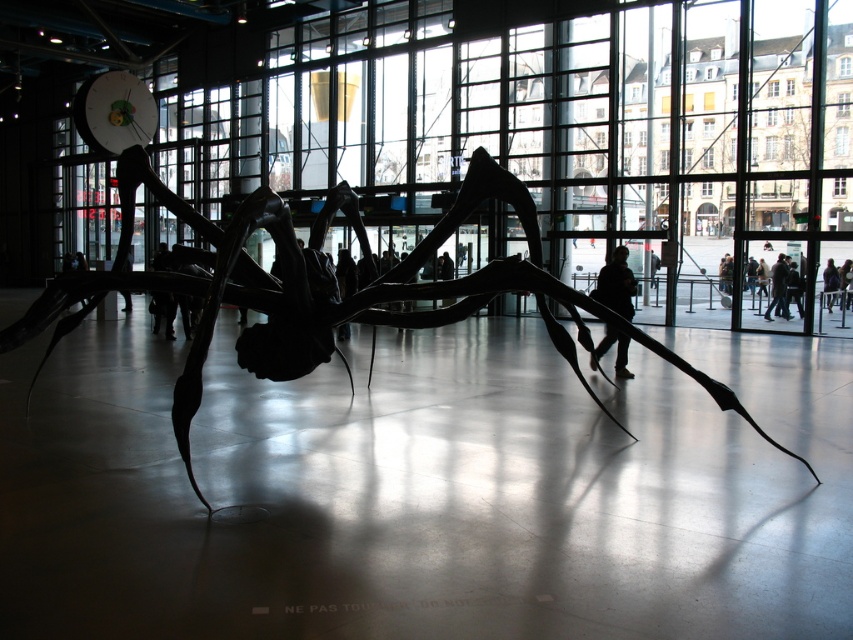
Question: Among these objects, which one is nearest to the camera?

Choices:
 (A) black matte jacket at center
 (B) black matte spider at center
 (C) dark hair at center
 (D) dark blue jeans at lower right

Answer: (B)

Question: Considering the real-world distances, which object is farthest from the dark blue jeans at lower right?

Choices:
 (A) black matte spider at center
 (B) black matte jacket at center

Answer: (A)

Question: Is the position of black matte spider at center more distant than that of dark hair at center?

Choices:
 (A) yes
 (B) no

Answer: (B)

Question: Can you confirm if black matte spider at center is bigger than black matte jacket at center?

Choices:
 (A) yes
 (B) no

Answer: (A)

Question: Estimate the real-world distances between objects in this image. Which object is farther from the dark blue jeans at lower right?

Choices:
 (A) black matte jacket at center
 (B) black matte spider at center
 (C) dark hair at center

Answer: (B)

Question: Does dark blue jeans at lower right have a smaller size compared to dark hair at center?

Choices:
 (A) yes
 (B) no

Answer: (B)